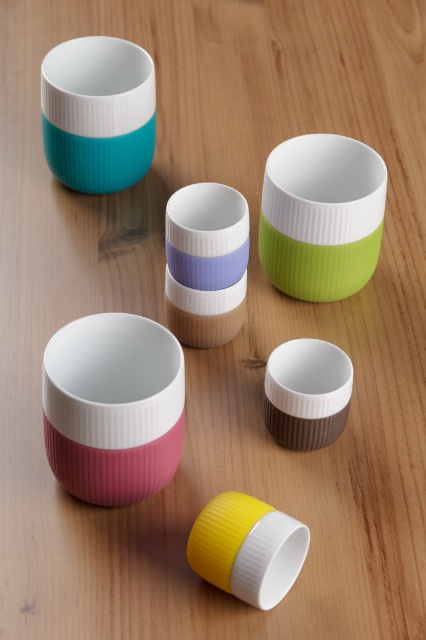
You are looking at the arrangement of cups on the wooden surface. Where is the yellow matte cup at lower center located in terms of coordinates?

The yellow matte cup at lower center is located at coordinates point (247,548).

You are setting up a table for a tea party and need to decide where to place the matte pink bowl at lower left and the teal matte cup at upper left. Considering their heights, which one should you place first to ensure stability?

The matte pink bowl at lower left has a lesser height compared to the teal matte cup at upper left. To ensure stability, place the taller teal matte cup at upper left first as the base, then place the shorter matte pink bowl at lower left on top of it.

You are standing in front of the six ceramic cups arranged on the wooden surface. You notice a point marked at coordinates (x=112, y=406). What object is located at that point?

The point at coordinates (x=112, y=406) is occupied by the matte pink bowl at lower left.